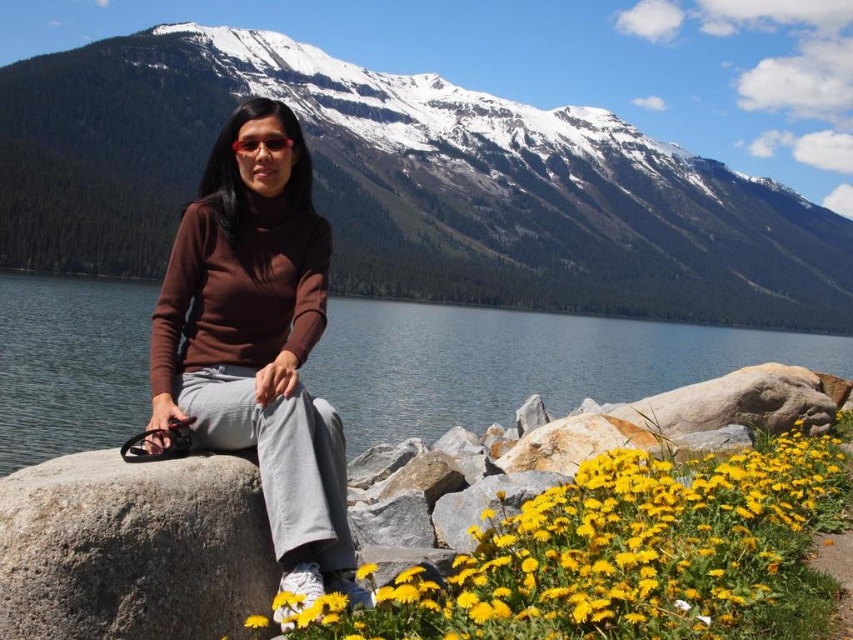
In the scene shown: You are a photographer trying to capture the matte brown sweater at center and the gray rough boulder at lower left in the same frame. Based on their positions, which object should you adjust your camera to focus on first to ensure both are in the shot?

The gray rough boulder at lower left should be focused on first since the matte brown sweater at center is to the right of it, meaning the boulder is closer to the left edge of the frame. By centering the boulder first, you can then adjust the camera to include the sweater to its right without losing either from the frame.

You are a photographer positioned at the edge of the lake, wanting to capture a photo of the brown matte sweater at center and the gray rough boulder at lower left. Which object should you focus on first to ensure it appears sharp in the foreground?

The brown matte sweater at center is further to the viewer than the gray rough boulder at lower left, so you should focus on the brown matte sweater at center first to ensure it appears sharp in the foreground.

You are a photographer trying to capture the matte brown sweater at center in your shot. The camera is positioned at point 0.5, 0.5. Which direction should you move the camera to frame the sweater better?

The matte brown sweater at center is located at point (518, 364), so you should move the camera slightly to the right and upward to center the sweater in the frame.